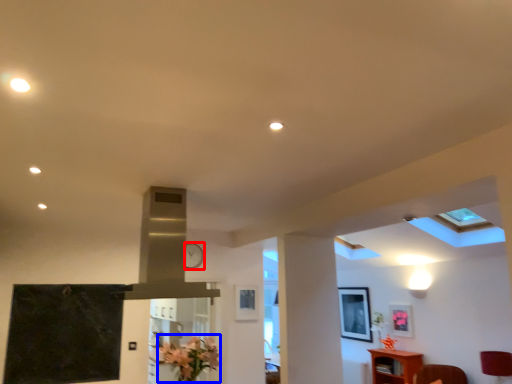
Question: Which object appears closest to the camera in this image, clock (highlighted by a red box) or flower (highlighted by a blue box)?

Choices:
 (A) clock
 (B) flower

Answer: (B)